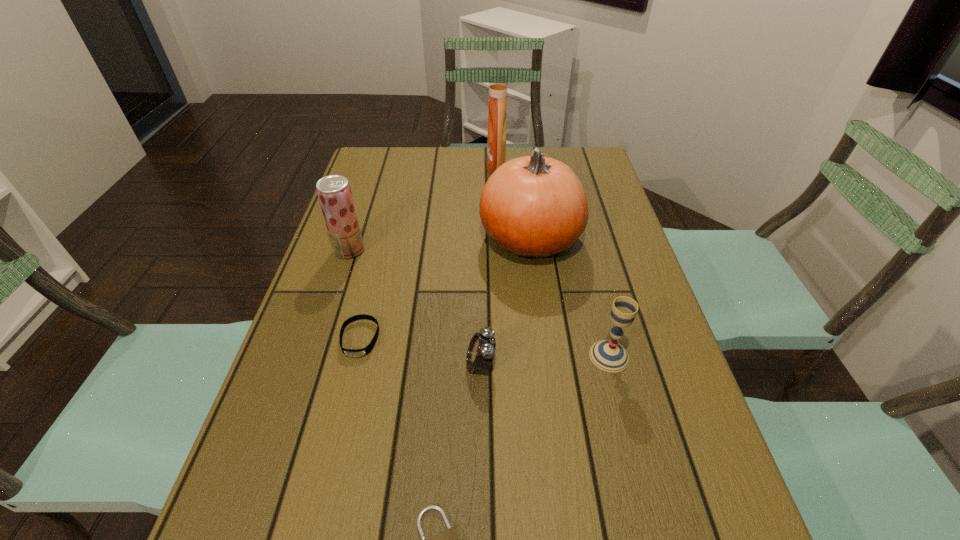
Locate an element on the screen. The width and height of the screenshot is (960, 540). free space between the pumpkin and the chalice is located at coordinates (570, 297).

Image resolution: width=960 pixels, height=540 pixels. I want to click on vacant space that is in between the fifth tallest object and the chalice, so click(x=545, y=360).

Locate an element on the screen. Image resolution: width=960 pixels, height=540 pixels. empty space between the pumpkin and the leftmost object is located at coordinates (440, 245).

You are a GUI agent. You are given a task and a screenshot of the screen. Output one action in this format:
    pyautogui.click(x=<x>, y=<y>)
    Task: Click on the empty location between the detergent and the fourth tallest object
    This screenshot has width=960, height=540.
    Given the screenshot: What is the action you would take?
    pyautogui.click(x=553, y=262)

Identify which object is the third nearest to the wristband. Please provide its 2D coordinates. Your answer should be formatted as a tuple, i.e. [(x, y)], where the tuple contains the x and y coordinates of a point satisfying the conditions above.

[(533, 206)]

You are a GUI agent. You are given a task and a screenshot of the screen. Output one action in this format:
    pyautogui.click(x=<x>, y=<y>)
    Task: Click on the object that ranks as the closest to the pumpkin
    Image resolution: width=960 pixels, height=540 pixels.
    Given the screenshot: What is the action you would take?
    pyautogui.click(x=498, y=85)

You are a GUI agent. You are given a task and a screenshot of the screen. Output one action in this format:
    pyautogui.click(x=<x>, y=<y>)
    Task: Click on the vacant space that satisfies the following two spatial constraints: 1. on the front-facing side of the farthest object; 2. on the back side of the pumpkin
    
    Given the screenshot: What is the action you would take?
    pyautogui.click(x=499, y=238)

Where is `free space that satisfies the following two spatial constraints: 1. on the front-facing side of the detergent; 2. on the display of the second object from left to right`? free space that satisfies the following two spatial constraints: 1. on the front-facing side of the detergent; 2. on the display of the second object from left to right is located at coordinates (505, 339).

Where is `vacant space that satisfies the following two spatial constraints: 1. on the front side of the chalice; 2. on the right side of the pumpkin`? The image size is (960, 540). vacant space that satisfies the following two spatial constraints: 1. on the front side of the chalice; 2. on the right side of the pumpkin is located at coordinates (545, 356).

Identify the location of vacant space that satisfies the following two spatial constraints: 1. on the front side of the chalice; 2. on the face of the fifth tallest object. The width and height of the screenshot is (960, 540). (612, 363).